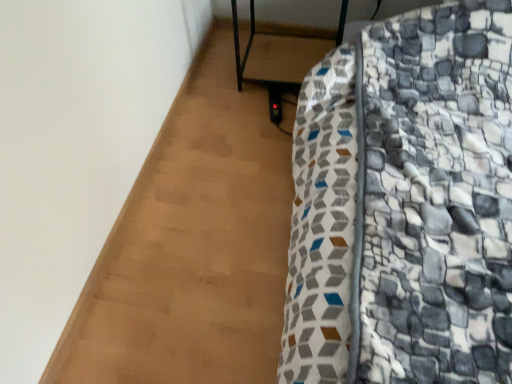
Question: From a real-world perspective, is metallic black side table at center, the second furniture positioned from the bottom, located higher than patterned fabric bed at lower right, arranged as the 1th furniture when ordered from the bottom?

Choices:
 (A) no
 (B) yes

Answer: (A)

Question: Does metallic black side table at center, the second furniture positioned from the bottom, turn towards patterned fabric bed at lower right, arranged as the 1th furniture when ordered from the bottom?

Choices:
 (A) no
 (B) yes

Answer: (A)

Question: Is metallic black side table at center, the second furniture positioned from the bottom, positioned beyond the bounds of patterned fabric bed at lower right, the 2th furniture when ordered from top to bottom?

Choices:
 (A) no
 (B) yes

Answer: (A)

Question: Can you confirm if metallic black side table at center, the second furniture positioned from the bottom, is positioned to the left of patterned fabric bed at lower right, arranged as the 1th furniture when ordered from the bottom?

Choices:
 (A) no
 (B) yes

Answer: (B)

Question: From the image's perspective, is metallic black side table at center, the second furniture positioned from the bottom, on top of patterned fabric bed at lower right, the 2th furniture when ordered from top to bottom?

Choices:
 (A) no
 (B) yes

Answer: (B)

Question: Is metallic black side table at center, the 1th furniture from the top, oriented away from patterned fabric bed at lower right, arranged as the 1th furniture when ordered from the bottom?

Choices:
 (A) yes
 (B) no

Answer: (B)

Question: Is patterned fabric bed at lower right, the 2th furniture when ordered from top to bottom, positioned beyond the bounds of metallic black side table at center, the 1th furniture from the top?

Choices:
 (A) no
 (B) yes

Answer: (B)

Question: Does patterned fabric bed at lower right, the 2th furniture when ordered from top to bottom, have a lesser width compared to metallic black side table at center, the 1th furniture from the top?

Choices:
 (A) no
 (B) yes

Answer: (A)

Question: From a real-world perspective, is patterned fabric bed at lower right, arranged as the 1th furniture when ordered from the bottom, physically below metallic black side table at center, the 1th furniture from the top?

Choices:
 (A) yes
 (B) no

Answer: (B)

Question: Considering the relative sizes of patterned fabric bed at lower right, the 2th furniture when ordered from top to bottom, and metallic black side table at center, the 1th furniture from the top, in the image provided, is patterned fabric bed at lower right, the 2th furniture when ordered from top to bottom, smaller than metallic black side table at center, the 1th furniture from the top,?

Choices:
 (A) no
 (B) yes

Answer: (A)

Question: Does patterned fabric bed at lower right, arranged as the 1th furniture when ordered from the bottom, have a lesser height compared to metallic black side table at center, the 1th furniture from the top?

Choices:
 (A) yes
 (B) no

Answer: (B)

Question: Is patterned fabric bed at lower right, the 2th furniture when ordered from top to bottom, looking in the opposite direction of metallic black side table at center, the second furniture positioned from the bottom?

Choices:
 (A) no
 (B) yes

Answer: (A)

Question: Do you think metallic black side table at center, the 1th furniture from the top, is within patterned fabric bed at lower right, arranged as the 1th furniture when ordered from the bottom, or outside of it?

Choices:
 (A) inside
 (B) outside

Answer: (A)